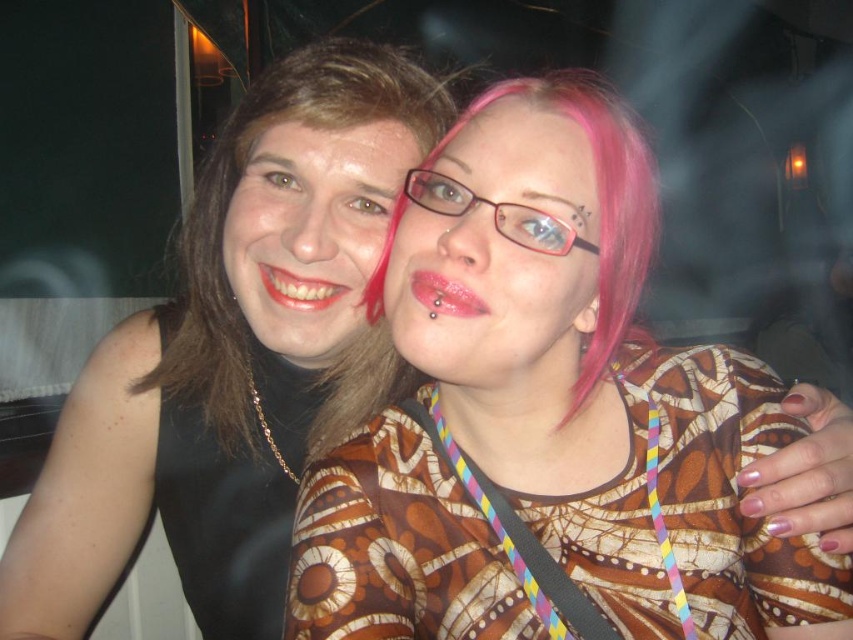
Question: Which of the following is the closest to the observer?

Choices:
 (A) (630, 541)
 (B) (33, 621)

Answer: (A)

Question: Is matte black dress at left to the right of shiny pink lipstick at center from the viewer's perspective?

Choices:
 (A) no
 (B) yes

Answer: (A)

Question: Is matte black dress at center to the left of shiny pink lipstick at center from the viewer's perspective?

Choices:
 (A) yes
 (B) no

Answer: (B)

Question: Which object is farther from the camera taking this photo?

Choices:
 (A) matte black dress at left
 (B) matte black dress at center

Answer: (A)

Question: Can you confirm if matte black dress at center is bigger than shiny white lipstick at center?

Choices:
 (A) no
 (B) yes

Answer: (B)

Question: Which of the following is the farthest from the observer?

Choices:
 (A) matte black dress at center
 (B) matte black dress at left

Answer: (B)